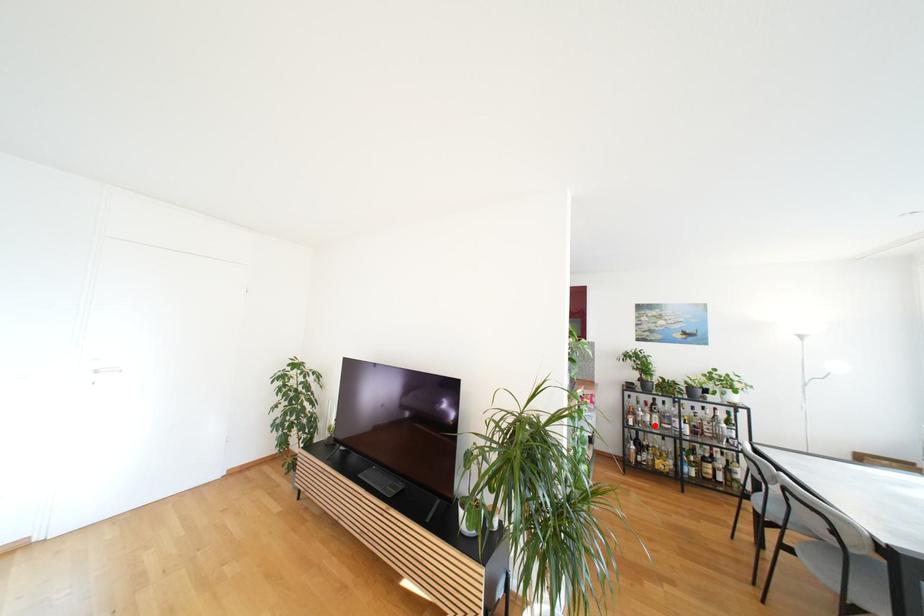
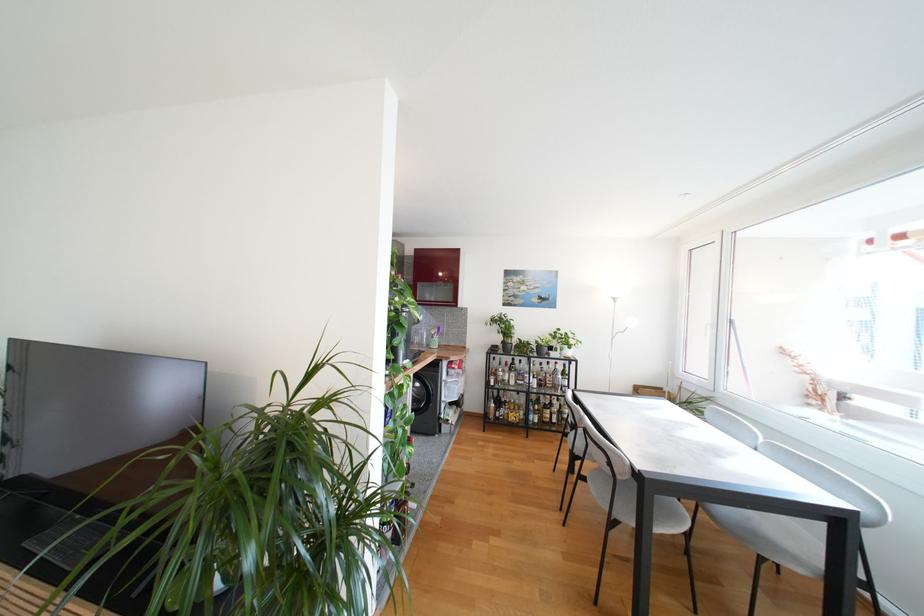
Question: I am providing you with two images of the same scene from different viewpoints. Image1 has a red point marked. In image2, the corresponding 3D location appears at what relative position? Reply with the corresponding letter.

Choices:
 (A) Closer
 (B) Farther

Answer: (B)